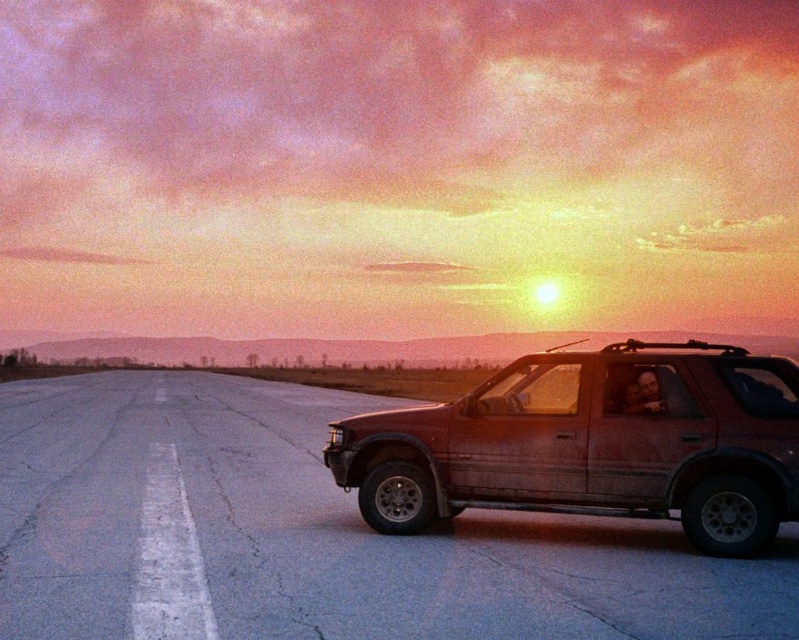
You are a drone operator trying to navigate between two points marked on your screen. The first point is at point (364, 534) and the second is at point (444, 513). Which point is closer to your drone if it is positioned at the same level as the horizon?

Point (364, 534) is closer to the drone because it is further to the viewer than point (444, 513), meaning it is nearer in the scene.

You are driving a car and want to reach the matte red suv at right which is parked on the smooth asphalt highway at center. Which direction should you turn to from the highway to approach the SUV?

The smooth asphalt highway at center is to the left of the matte red suv at right, so you should turn right from the highway to approach the SUV.